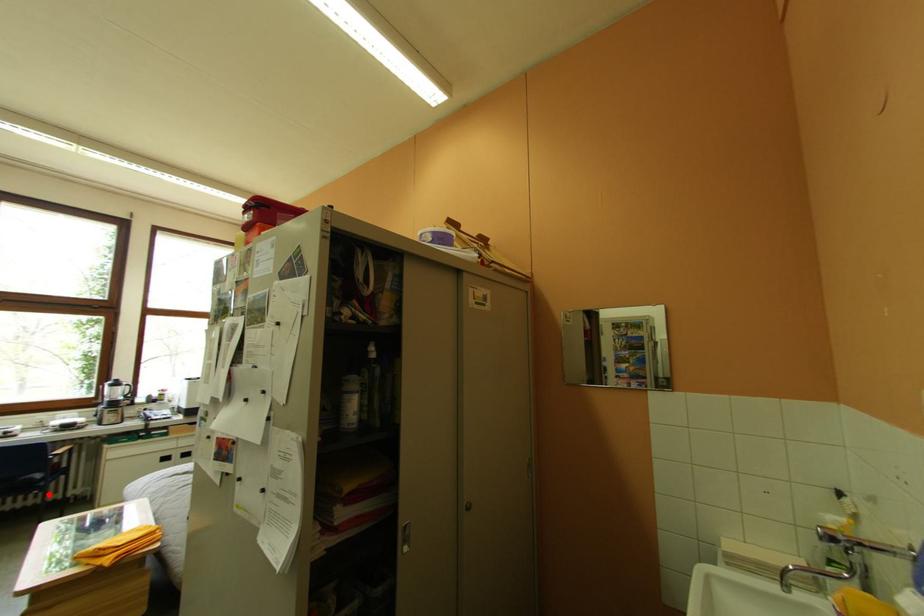
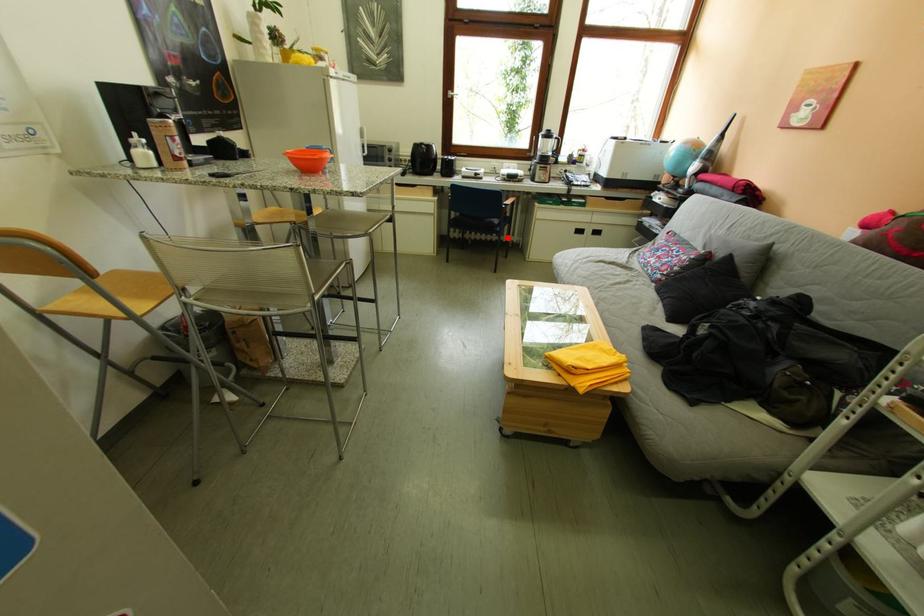
I am providing you with two images of the same scene from different viewpoints. A red point is marked on the first image and another point is marked on the second image. Do the highlighted points in image1 and image2 indicate the same real-world spot?

Yes